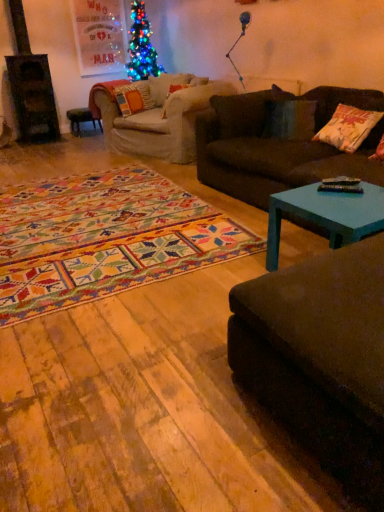
Question: From the image's perspective, is teal painted wood coffee table at lower right beneath white cotton pillow at right, which is the second pillow from top to bottom?

Choices:
 (A) yes
 (B) no

Answer: (A)

Question: Does teal painted wood coffee table at lower right come in front of white cotton pillow at right, the first pillow from the bottom?

Choices:
 (A) yes
 (B) no

Answer: (A)

Question: Would you say teal painted wood coffee table at lower right is a long distance from white cotton pillow at right, acting as the first pillow starting from the front?

Choices:
 (A) no
 (B) yes

Answer: (B)

Question: Is teal painted wood coffee table at lower right looking in the opposite direction of white cotton pillow at right, arranged as the 2th pillow when viewed from the back?

Choices:
 (A) yes
 (B) no

Answer: (B)

Question: Is teal painted wood coffee table at lower right shorter than white cotton pillow at right, arranged as the 2th pillow when viewed from the back?

Choices:
 (A) yes
 (B) no

Answer: (A)

Question: From their relative heights in the image, would you say teal painted wood coffee table at lower right is taller or shorter than white cotton pillow at right, which is the first pillow from right to left?

Choices:
 (A) short
 (B) tall

Answer: (A)

Question: Is teal painted wood coffee table at lower right wider or thinner than white cotton pillow at right, which is counted as the second pillow, starting from the left?

Choices:
 (A) thin
 (B) wide

Answer: (B)

Question: Considering the positions of teal painted wood coffee table at lower right and white cotton pillow at right, the first pillow from the bottom, in the image, is teal painted wood coffee table at lower right bigger or smaller than white cotton pillow at right, the first pillow from the bottom,?

Choices:
 (A) small
 (B) big

Answer: (B)

Question: Considering the positions of point (311, 202) and point (359, 121), is point (311, 202) closer or farther from the camera than point (359, 121)?

Choices:
 (A) farther
 (B) closer

Answer: (B)

Question: In the image, is velvet dark brown couch at lower right, placed as the 1th studio couch when sorted from bottom to top, positioned in front of or behind teal painted wood coffee table at lower right?

Choices:
 (A) behind
 (B) front

Answer: (B)

Question: In terms of size, does velvet dark brown couch at lower right, arranged as the 1th studio couch when viewed from the front, appear bigger or smaller than teal painted wood coffee table at lower right?

Choices:
 (A) small
 (B) big

Answer: (B)

Question: Would you say velvet dark brown couch at lower right, placed as the 1th studio couch when sorted from bottom to top, is inside or outside teal painted wood coffee table at lower right?

Choices:
 (A) outside
 (B) inside

Answer: (A)

Question: From their relative heights in the image, would you say velvet dark brown couch at lower right, arranged as the 1th studio couch when viewed from the front, is taller or shorter than teal painted wood coffee table at lower right?

Choices:
 (A) short
 (B) tall

Answer: (B)

Question: From the image's perspective, is teal painted wood coffee table at lower right located above or below velvet dark brown couch at lower right, the 2th studio couch in the top-to-bottom sequence?

Choices:
 (A) below
 (B) above

Answer: (B)

Question: Based on their positions, is teal painted wood coffee table at lower right located to the left or right of velvet dark brown couch at lower right, arranged as the 1th studio couch when viewed from the front?

Choices:
 (A) left
 (B) right

Answer: (B)